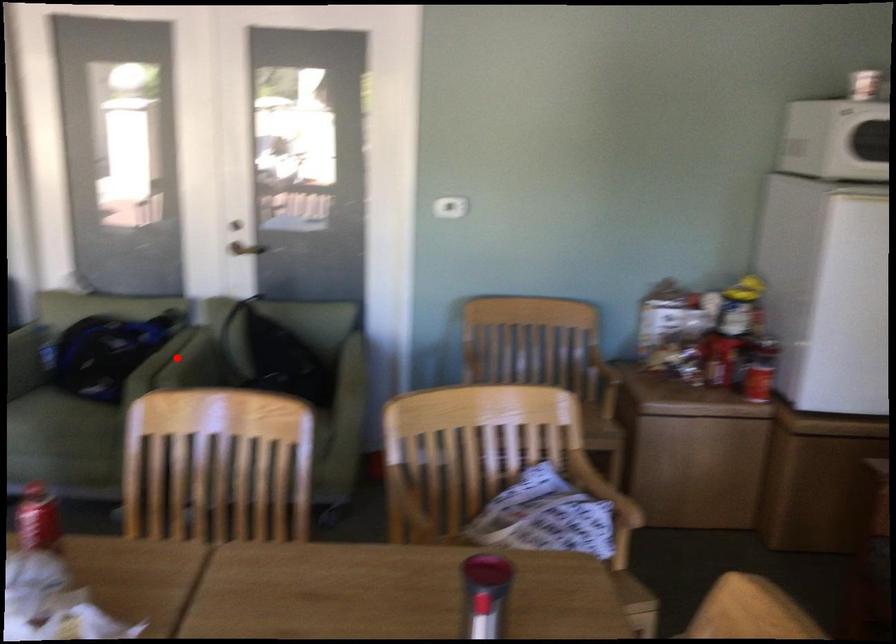
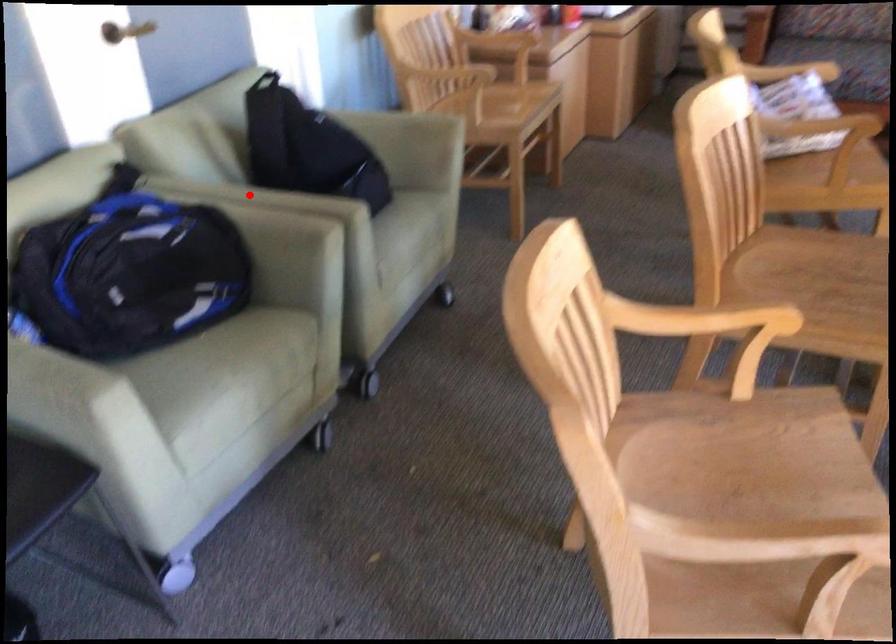
I am providing you with two images of the same scene from different viewpoints. A red point is marked on the first image and another point is marked on the second image. Are the points marked in image1 and image2 representing the same 3D position?

Yes